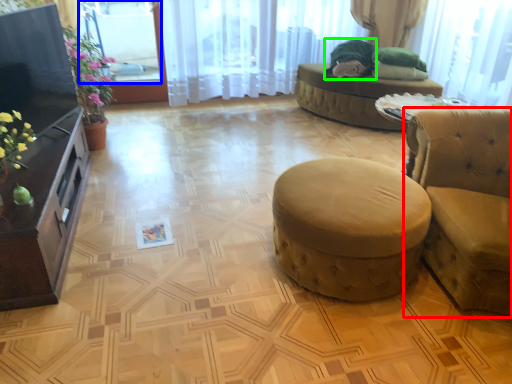
Question: Which is farther away from studio couch (highlighted by a red box)? window screen (highlighted by a blue box) or open (highlighted by a green box)?

Choices:
 (A) window screen
 (B) open

Answer: (A)